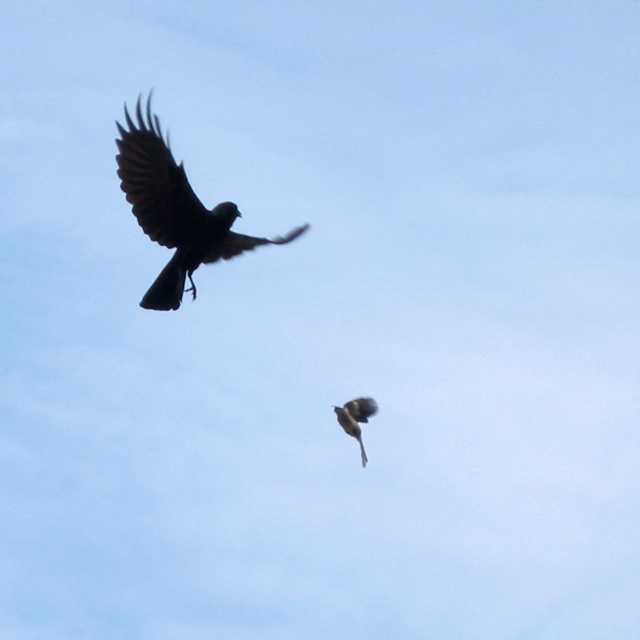
You are a birdwatcher trying to identify the position of the silhouette glossy bird at upper left. Based on the coordinates provided, can you determine if it is closer to the top or bottom of the image?

The silhouette glossy bird at upper left is located at point (176, 211). Since the y coordinate is 0.275, which is closer to the bottom of the image, it is positioned more towards the bottom than the top.

You are a drone operator trying to capture a photo of two birds in flight. You have two points marked on your screen, point A at coordinates point (132, 145) and point B at coordinates point (356, 403). Which point is closer to your camera?

Point A at coordinates point (132, 145) is closer to the camera because it is further to the viewer than point B at coordinates point (356, 403).